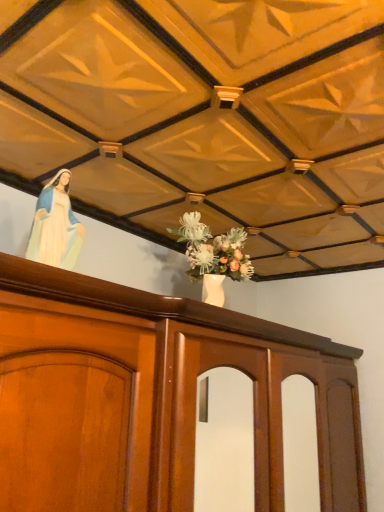
In order to face wooden cabinet at center, should I rotate leftwards or rightwards?

Turn right approximately 1.301 degrees to face it.

In order to click on wooden cabinet at center in this screenshot , I will do `click(150, 395)`.

Measure the distance between point (130, 403) and camera.

The distance of point (130, 403) from camera is 37.87 inches.

Describe the element at coordinates (150, 395) in the screenshot. I see `wooden cabinet at center` at that location.

Describe the element at coordinates (55, 226) in the screenshot. The width and height of the screenshot is (384, 512). I see `smooth porcelain statue at upper left` at that location.

I want to click on smooth porcelain statue at upper left, so (55, 226).

Locate an element on the screen. wooden cabinet at center is located at coordinates (150, 395).

Based on their positions, is smooth porcelain statue at upper left located to the left or right of wooden cabinet at center?

smooth porcelain statue at upper left is positioned on wooden cabinet at center's left side.

Is smooth porcelain statue at upper left in front of wooden cabinet at center?

No, it is not.

Which point is more forward, (49, 198) or (112, 290)?

The point (112, 290) is closer.

From the image's perspective, between smooth porcelain statue at upper left and wooden cabinet at center, who is located below?

wooden cabinet at center, from the image's perspective.

From a real-world perspective, between smooth porcelain statue at upper left and wooden cabinet at center, who is vertically lower?

wooden cabinet at center is physically lower.

Considering the sizes of objects smooth porcelain statue at upper left and wooden cabinet at center in the image provided, who is thinner, smooth porcelain statue at upper left or wooden cabinet at center?

smooth porcelain statue at upper left is thinner.

Considering the sizes of objects smooth porcelain statue at upper left and wooden cabinet at center in the image provided, who is taller, smooth porcelain statue at upper left or wooden cabinet at center?

With more height is wooden cabinet at center.

Considering the relative sizes of smooth porcelain statue at upper left and wooden cabinet at center in the image provided, is smooth porcelain statue at upper left smaller than wooden cabinet at center?

Yes.

Is smooth porcelain statue at upper left surrounding wooden cabinet at center?

No.

Is smooth porcelain statue at upper left positioned far away from wooden cabinet at center?

smooth porcelain statue at upper left is actually quite close to wooden cabinet at center.

Does smooth porcelain statue at upper left turn towards wooden cabinet at center?

No, smooth porcelain statue at upper left is not facing towards wooden cabinet at center.

Where is `furniture below the smooth porcelain statue at upper left (from a real-world perspective)`? The height and width of the screenshot is (512, 384). furniture below the smooth porcelain statue at upper left (from a real-world perspective) is located at coordinates (150, 395).

Between wooden cabinet at center and smooth porcelain statue at upper left, which one appears on the left side from the viewer's perspective?

From the viewer's perspective, smooth porcelain statue at upper left appears more on the left side.

Is the position of wooden cabinet at center less distant than that of smooth porcelain statue at upper left?

Yes, it is in front of smooth porcelain statue at upper left.

Is point (49, 450) in front of point (39, 246)?

Yes, it is in front of point (39, 246).

From the image's perspective, relative to smooth porcelain statue at upper left, is wooden cabinet at center above or below?

Clearly, from the image's perspective, wooden cabinet at center is below smooth porcelain statue at upper left.

From a real-world perspective, which object stands above the other?

smooth porcelain statue at upper left, from a real-world perspective.

Between wooden cabinet at center and smooth porcelain statue at upper left, which one has larger width?

wooden cabinet at center is wider.

Considering the sizes of wooden cabinet at center and smooth porcelain statue at upper left in the image, is wooden cabinet at center taller or shorter than smooth porcelain statue at upper left?

Considering their sizes, wooden cabinet at center has more height than smooth porcelain statue at upper left.

Which of these two, wooden cabinet at center or smooth porcelain statue at upper left, is smaller?

smooth porcelain statue at upper left is smaller.

Looking at this image, is smooth porcelain statue at upper left surrounded by wooden cabinet at center?

That's incorrect, smooth porcelain statue at upper left is not inside wooden cabinet at center.

Is wooden cabinet at center directly adjacent to smooth porcelain statue at upper left?

No, wooden cabinet at center is not beside smooth porcelain statue at upper left.

Consider the image. Is wooden cabinet at center facing away from smooth porcelain statue at upper left?

No, smooth porcelain statue at upper left is not at the back of wooden cabinet at center.

In the image, there is a wooden cabinet at center. Identify the location of woman above it (from the image's perspective). The height and width of the screenshot is (512, 384). (55, 226).

In order to click on woman lying above the wooden cabinet at center (from the image's perspective) in this screenshot , I will do `click(55, 226)`.

The image size is (384, 512). What are the coordinates of `woman behind the wooden cabinet at center` in the screenshot? It's located at (55, 226).